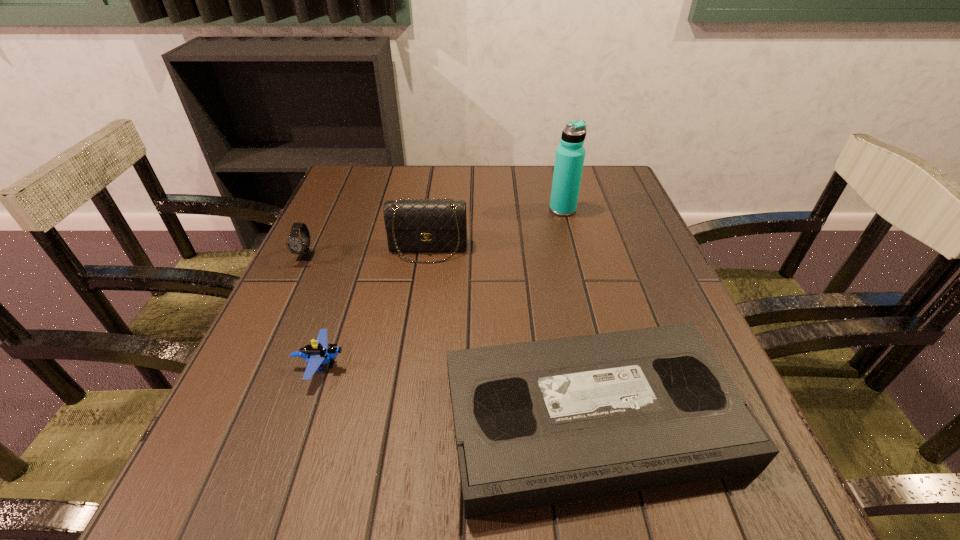
Where is `free region at the far edge of the desktop`? This screenshot has width=960, height=540. free region at the far edge of the desktop is located at coordinates (535, 170).

At what (x,y) coordinates should I click in order to perform the action: click on blank space at the near edge of the desktop. Please return your answer as a coordinate pair (x, y). This screenshot has height=540, width=960. Looking at the image, I should click on (364, 470).

The width and height of the screenshot is (960, 540). In order to click on free space at the left edge of the desktop in this screenshot , I will do `click(316, 309)`.

In the image, there is a desktop. Identify the location of free space at the right edge. This screenshot has height=540, width=960. (599, 269).

What are the coordinates of `vacant region at the far left corner of the desktop` in the screenshot? It's located at (342, 208).

The height and width of the screenshot is (540, 960). I want to click on vacant space at the near left corner, so click(x=276, y=530).

The height and width of the screenshot is (540, 960). Find the location of `vacant space at the far right corner`. vacant space at the far right corner is located at coordinates (615, 195).

What are the coordinates of `vacant point located between the Lego and the farthest object` in the screenshot? It's located at (442, 287).

The image size is (960, 540). What are the coordinates of `free spot between the second tallest object and the Lego` in the screenshot? It's located at (374, 307).

The height and width of the screenshot is (540, 960). I want to click on vacant space that's between the videotape and the third shortest object, so click(x=448, y=337).